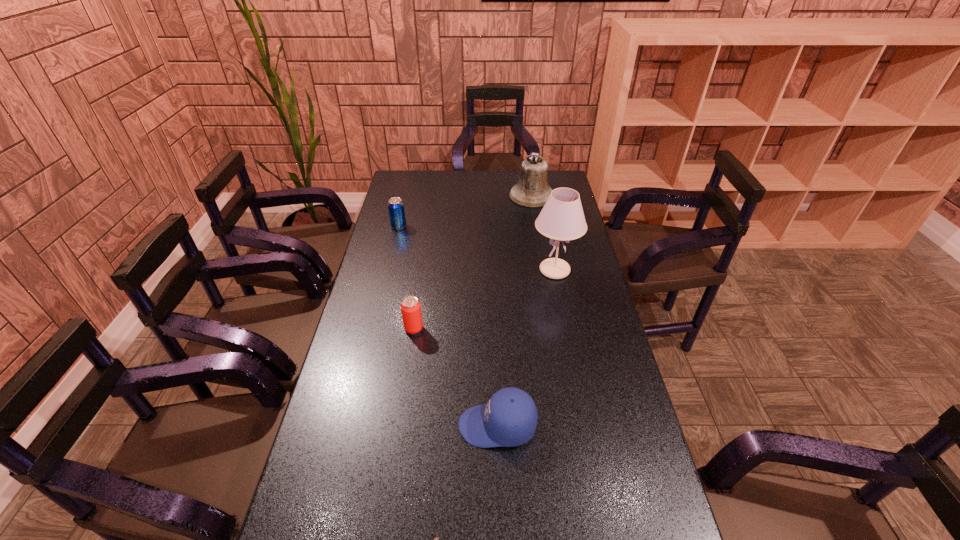
Point out which object is positioned as the third nearest to the leftmost object. Please provide its 2D coordinates. Your answer should be formatted as a tuple, i.e. [(x, y)], where the tuple contains the x and y coordinates of a point satisfying the conditions above.

[(562, 218)]

Select which object is the fifth closest to the nearest object. Please provide its 2D coordinates. Your answer should be formatted as a tuple, i.e. [(x, y)], where the tuple contains the x and y coordinates of a point satisfying the conditions above.

[(532, 190)]

The height and width of the screenshot is (540, 960). In order to click on vacant space that satisfies the following two spatial constraints: 1. on the front side of the farthest object; 2. on the front-facing side of the second nearest object in this screenshot , I will do `click(571, 426)`.

Image resolution: width=960 pixels, height=540 pixels. What are the coordinates of `free point that satisfies the following two spatial constraints: 1. on the back side of the nearer beer can; 2. on the right side of the fourth nearest object` in the screenshot? It's located at (422, 270).